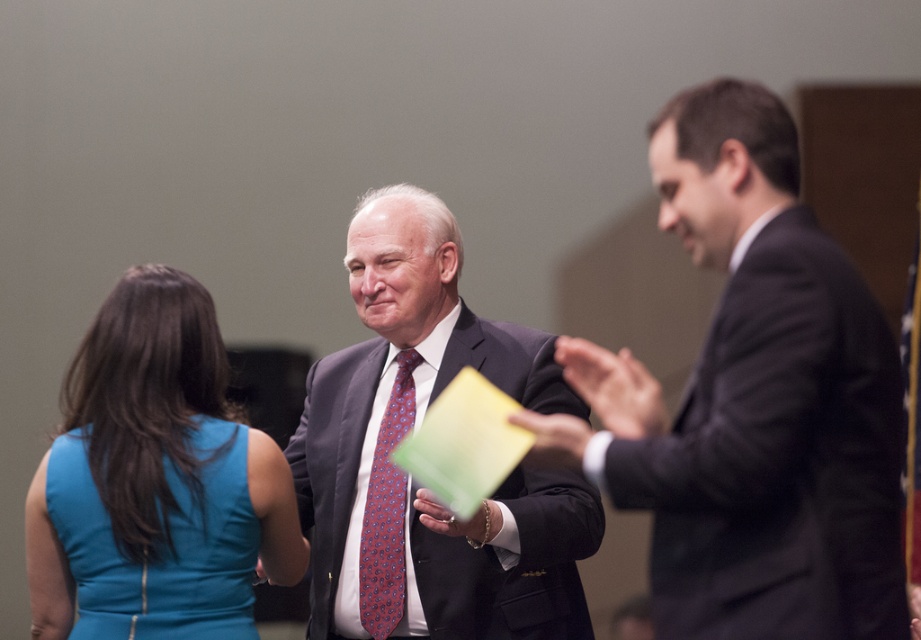
Who is lower down, matte gray suit at center or blue satin dress at lower left?

blue satin dress at lower left is below.

Is matte gray suit at center positioned before blue satin dress at lower left?

No, it is not.

The width and height of the screenshot is (921, 640). What do you see at coordinates (414, 481) in the screenshot?
I see `matte gray suit at center` at bounding box center [414, 481].

Find the location of a particular element. matte gray suit at center is located at coordinates (414, 481).

Does matte gray suit at center appear over teal satin dress at lower left?

Indeed, matte gray suit at center is positioned over teal satin dress at lower left.

Can you confirm if matte gray suit at center is taller than teal satin dress at lower left?

Indeed, matte gray suit at center has a greater height compared to teal satin dress at lower left.

Identify the location of matte gray suit at center. The image size is (921, 640). (414, 481).

Is point (187, 490) farther from viewer compared to point (389, 397)?

No.

Is teal satin dress at lower left wider than red paisley silk tie at center?

Yes.

Is point (243, 486) positioned before point (391, 621)?

Yes, it is in front of point (391, 621).

Locate an element on the screen. The width and height of the screenshot is (921, 640). teal satin dress at lower left is located at coordinates (161, 548).